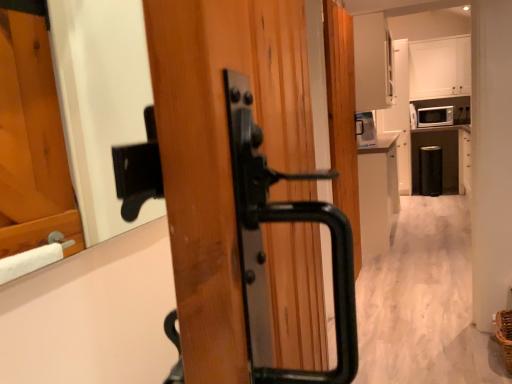
At what (x,y) coordinates should I click in order to perform the action: click on matte white microwave at upper right. Please return your answer as a coordinate pair (x, y). The image size is (512, 384). Looking at the image, I should click on (435, 116).

Identify the location of matte white microwave at upper right. (435, 116).

Is white glossy cabinet at center, the 1th cabinetry when ordered from left to right, to the left of matte white microwave at upper right from the viewer's perspective?

Yes.

Is point (395, 187) less distant than point (438, 110)?

Yes, it is in front of point (438, 110).

From the picture: Is white glossy cabinet at center, the second cabinetry from the top, bigger than matte white microwave at upper right?

Indeed, white glossy cabinet at center, the second cabinetry from the top, has a larger size compared to matte white microwave at upper right.

Is white matte cabinet at upper center, the 2th cabinetry viewed from the front, far away from white glossy cabinet at center, the 1th cabinetry when ordered from left to right?

Absolutely, white matte cabinet at upper center, the 2th cabinetry viewed from the front, is distant from white glossy cabinet at center, the 1th cabinetry when ordered from left to right.

From a real-world perspective, which object rests below the other?

white glossy cabinet at center, the second cabinetry from the top, from a real-world perspective.

The width and height of the screenshot is (512, 384). What are the coordinates of `cabinetry on the right of white glossy cabinet at center, acting as the 1th cabinetry starting from the front` in the screenshot? It's located at pyautogui.click(x=440, y=68).

Where is `cabinetry on the right of matte white microwave at upper right`? This screenshot has height=384, width=512. cabinetry on the right of matte white microwave at upper right is located at coordinates (440, 68).

Is white matte cabinet at upper center, the first cabinetry when ordered from right to left, inside the boundaries of matte white microwave at upper right, or outside?

white matte cabinet at upper center, the first cabinetry when ordered from right to left, lies outside matte white microwave at upper right.

Which object is further away from the camera, white matte cabinet at upper center, the first cabinetry when ordered from right to left, or matte white microwave at upper right?

matte white microwave at upper right is behind.

Is white matte cabinet at upper center, the 2th cabinetry viewed from the front, not close to matte white microwave at upper right?

Actually, white matte cabinet at upper center, the 2th cabinetry viewed from the front, and matte white microwave at upper right are a little close together.

Where is `the 1st cabinetry in front of the matte white microwave at upper right`? This screenshot has height=384, width=512. the 1st cabinetry in front of the matte white microwave at upper right is located at coordinates (440, 68).

Is matte white microwave at upper right spatially inside white matte cabinet at upper center, the 1th cabinetry when ordered from back to front, or outside of it?

matte white microwave at upper right lies outside white matte cabinet at upper center, the 1th cabinetry when ordered from back to front.

Does point (451, 124) come farther from viewer compared to point (457, 83)?

No.

Is matte white microwave at upper right positioned in front of white matte cabinet at upper center, the 2th cabinetry viewed from the front?

No, matte white microwave at upper right is behind white matte cabinet at upper center, the 2th cabinetry viewed from the front.

Measure the distance between matte white microwave at upper right and white glossy cabinet at center, the second cabinetry from the top.

A distance of 7.87 feet exists between matte white microwave at upper right and white glossy cabinet at center, the second cabinetry from the top.

Can you tell me how much matte white microwave at upper right and white glossy cabinet at center, the 1th cabinetry when ordered from left to right, differ in facing direction?

They differ by 87.7 degrees in their facing directions.

Does matte white microwave at upper right have a smaller size compared to white glossy cabinet at center, the second cabinetry from the top?

Indeed, matte white microwave at upper right has a smaller size compared to white glossy cabinet at center, the second cabinetry from the top.

Which of these two, matte white microwave at upper right or white glossy cabinet at center, placed as the 1th cabinetry when sorted from bottom to top, stands shorter?

matte white microwave at upper right.

Relative to white matte cabinet at upper center, the first cabinetry when ordered from right to left, is white glossy cabinet at center, acting as the 1th cabinetry starting from the front, in front or behind?

Clearly, white glossy cabinet at center, acting as the 1th cabinetry starting from the front, is in front of white matte cabinet at upper center, the first cabinetry when ordered from right to left.

Is white glossy cabinet at center, the 2th cabinetry viewed from the back, completely or partially outside of white matte cabinet at upper center, the first cabinetry when ordered from right to left?

white glossy cabinet at center, the 2th cabinetry viewed from the back, lies outside white matte cabinet at upper center, the first cabinetry when ordered from right to left,'s area.

Is point (378, 245) closer or farther from the camera than point (428, 62)?

Point (378, 245).

Does white glossy cabinet at center, placed as the 1th cabinetry when sorted from bottom to top, have a greater width compared to white matte cabinet at upper center, which appears as the 1th cabinetry when viewed from the top?

Incorrect, the width of white glossy cabinet at center, placed as the 1th cabinetry when sorted from bottom to top, does not surpass that of white matte cabinet at upper center, which appears as the 1th cabinetry when viewed from the top.

The height and width of the screenshot is (384, 512). I want to click on cabinetry to the left of matte white microwave at upper right, so (378, 194).

Find the location of a particular element. The width and height of the screenshot is (512, 384). cabinetry located underneath the white matte cabinet at upper center, the 2th cabinetry viewed from the front (from a real-world perspective) is located at coordinates (378, 194).

Looking at the image, which one is located further to matte white microwave at upper right, white glossy cabinet at center, the second cabinetry from the top, or white matte cabinet at upper center, the second cabinetry when ordered from bottom to top?

white glossy cabinet at center, the second cabinetry from the top.

When comparing their distances from white glossy cabinet at center, the second cabinetry from the top, does matte white microwave at upper right or white matte cabinet at upper center, the 1th cabinetry when ordered from back to front, seem further?

Based on the image, white matte cabinet at upper center, the 1th cabinetry when ordered from back to front, appears to be further to white glossy cabinet at center, the second cabinetry from the top.

In the scene shown: Which object lies nearer to the anchor point matte white microwave at upper right, white matte cabinet at upper center, which is the 2th cabinetry from left to right, or white glossy cabinet at center, the 1th cabinetry when ordered from left to right?

Based on the image, white matte cabinet at upper center, which is the 2th cabinetry from left to right, appears to be nearer to matte white microwave at upper right.

Which object lies further to the anchor point white glossy cabinet at center, the 1th cabinetry when ordered from left to right, white matte cabinet at upper center, the 2th cabinetry viewed from the front, or matte white microwave at upper right?

white matte cabinet at upper center, the 2th cabinetry viewed from the front, lies further to white glossy cabinet at center, the 1th cabinetry when ordered from left to right, than the other object.

When comparing their distances from white matte cabinet at upper center, which is the 2th cabinetry from left to right, does white glossy cabinet at center, placed as the second cabinetry when sorted from right to left, or matte white microwave at upper right seem closer?

matte white microwave at upper right is positioned closer to the anchor white matte cabinet at upper center, which is the 2th cabinetry from left to right.

Estimate the real-world distances between objects in this image. Which object is closer to white matte cabinet at upper center, the second cabinetry when ordered from bottom to top, matte white microwave at upper right or white glossy cabinet at center, the 2th cabinetry viewed from the back?

The object closer to white matte cabinet at upper center, the second cabinetry when ordered from bottom to top, is matte white microwave at upper right.

At what (x,y) coordinates should I click in order to perform the action: click on cabinetry between white glossy cabinet at center, acting as the 1th cabinetry starting from the front, and matte white microwave at upper right in the front-back direction. Please return your answer as a coordinate pair (x, y). This screenshot has height=384, width=512. Looking at the image, I should click on (440, 68).